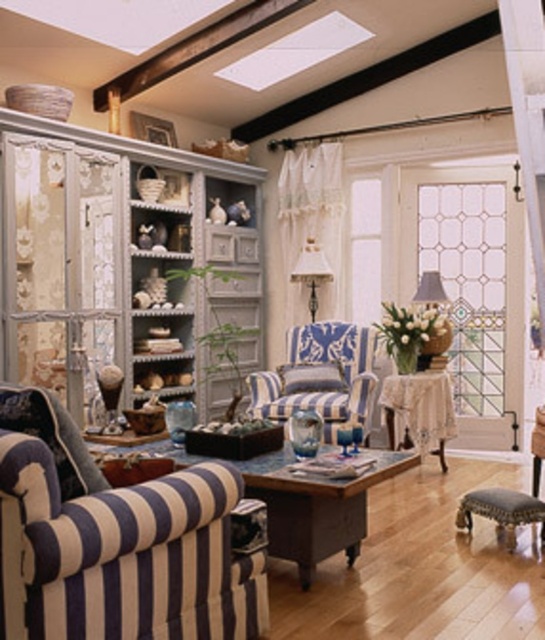
Is blue striped fabric couch at lower left above blue striped armchair at center?

No, blue striped fabric couch at lower left is not above blue striped armchair at center.

Locate an element on the screen. Image resolution: width=545 pixels, height=640 pixels. blue striped fabric couch at lower left is located at coordinates (114, 541).

The width and height of the screenshot is (545, 640). I want to click on blue striped fabric couch at lower left, so click(114, 541).

The height and width of the screenshot is (640, 545). Describe the element at coordinates (320, 376) in the screenshot. I see `blue striped armchair at center` at that location.

Is blue striped armchair at center taller than dark brown leather stool at lower right?

Indeed, blue striped armchair at center has a greater height compared to dark brown leather stool at lower right.

I want to click on blue striped armchair at center, so click(320, 376).

Does blue striped fabric couch at lower left lie in front of dark brown leather stool at lower right?

Yes, blue striped fabric couch at lower left is closer to the viewer.

Can you confirm if blue striped fabric couch at lower left is positioned below dark brown leather stool at lower right?

Actually, blue striped fabric couch at lower left is above dark brown leather stool at lower right.

Measure the distance between blue striped fabric couch at lower left and camera.

A distance of 1.97 meters exists between blue striped fabric couch at lower left and camera.

The image size is (545, 640). In order to click on blue striped fabric couch at lower left in this screenshot , I will do `click(114, 541)`.